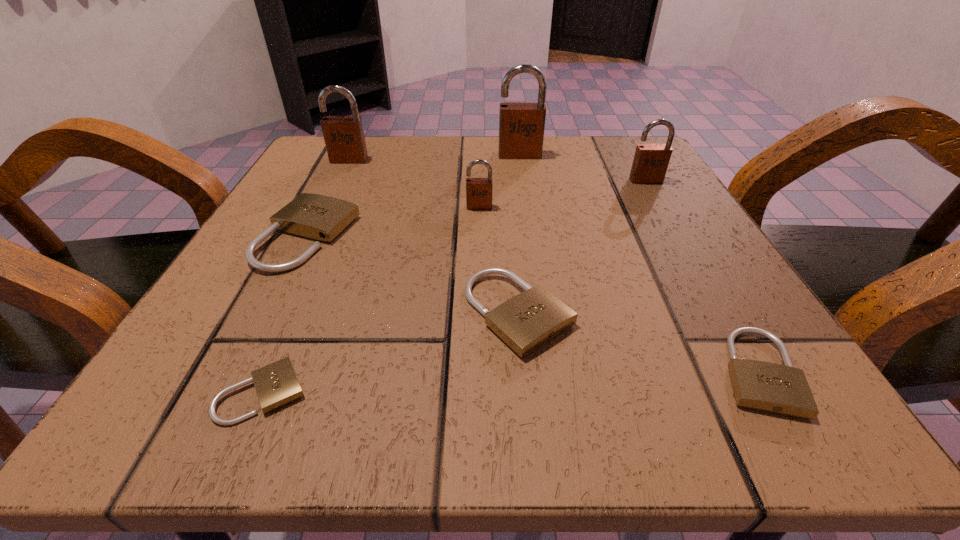
Where is `free space located on the right of the fourth shortest object`? free space located on the right of the fourth shortest object is located at coordinates click(421, 237).

The height and width of the screenshot is (540, 960). Identify the location of free location located on the left of the second beige padlock from right to left. (258, 313).

Image resolution: width=960 pixels, height=540 pixels. What are the coordinates of `vacant position located 0.400m on the back of the second smallest beige padlock` in the screenshot? It's located at (644, 177).

I want to click on free space located 0.080m on the left of the smallest beige padlock, so click(148, 393).

In order to click on object located at the far left corner in this screenshot , I will do `click(344, 138)`.

Find the location of a particular element. The width and height of the screenshot is (960, 540). object that is positioned at the near left corner is located at coordinates (276, 384).

Where is `object located in the far right corner section of the desktop`? object located in the far right corner section of the desktop is located at coordinates (650, 163).

Locate an element on the screen. object situated at the near right corner is located at coordinates (768, 387).

The image size is (960, 540). Identify the location of vacant space at the far edge. (522, 171).

Identify the location of free space at the near edge of the desktop. (504, 380).